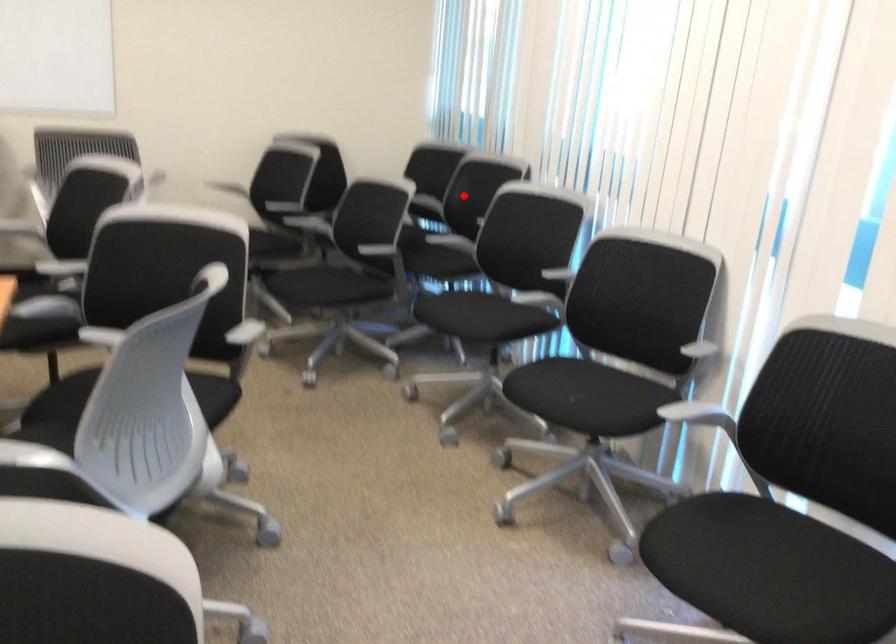
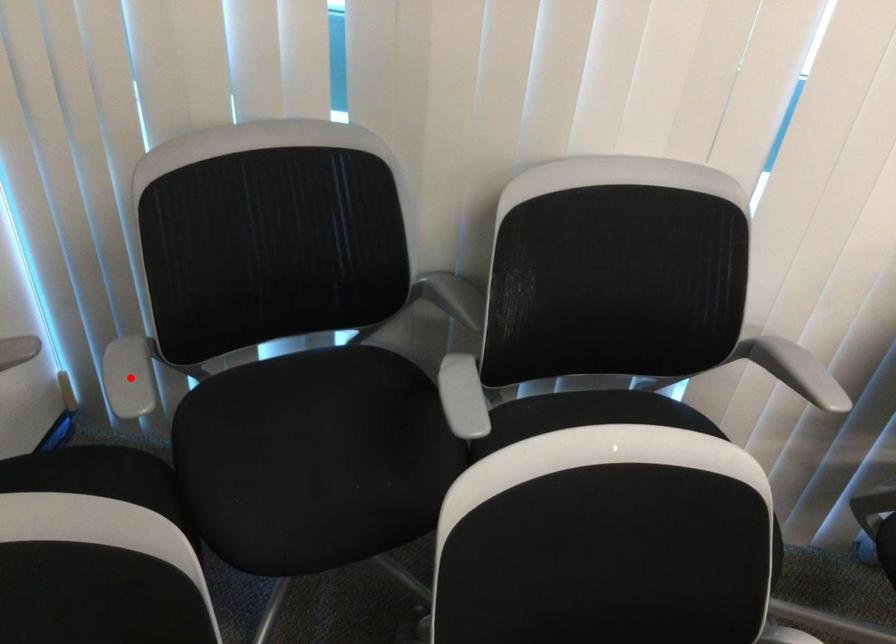
I am providing you with two images of the same scene from different viewpoints. A red point is marked on the first image and another point is marked on the second image. Do the highlighted points in image1 and image2 indicate the same real-world spot?

No